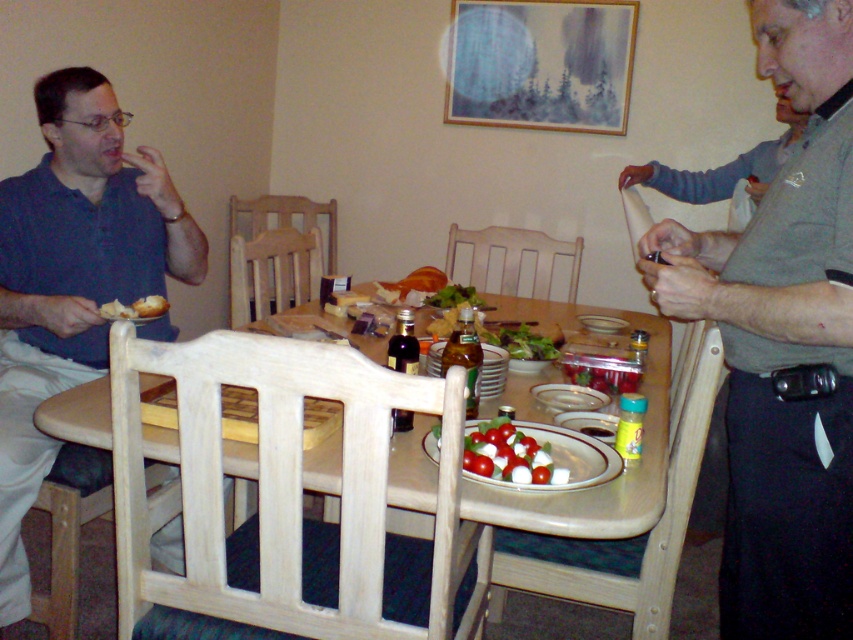
Who is more forward, (x=16, y=314) or (x=532, y=396)?

Positioned in front is point (x=532, y=396).

Is the position of matte blue shirt at left more distant than that of white ceramic platter at center?

Yes, matte blue shirt at left is behind white ceramic platter at center.

The image size is (853, 640). Describe the element at coordinates (73, 276) in the screenshot. I see `matte blue shirt at left` at that location.

Where is `matte blue shirt at left`? Image resolution: width=853 pixels, height=640 pixels. matte blue shirt at left is located at coordinates (73, 276).

In the scene shown: Does gray cotton shirt at right lie in front of white ceramic platter at center?

Yes, gray cotton shirt at right is closer to the viewer.

The width and height of the screenshot is (853, 640). Find the location of `gray cotton shirt at right`. gray cotton shirt at right is located at coordinates (782, 342).

Does matte blue shirt at left come in front of matte glass platter at center?

That is False.

What do you see at coordinates (73, 276) in the screenshot? I see `matte blue shirt at left` at bounding box center [73, 276].

Who is more forward, (13, 612) or (577, 436)?

Point (577, 436)

I want to click on matte blue shirt at left, so click(x=73, y=276).